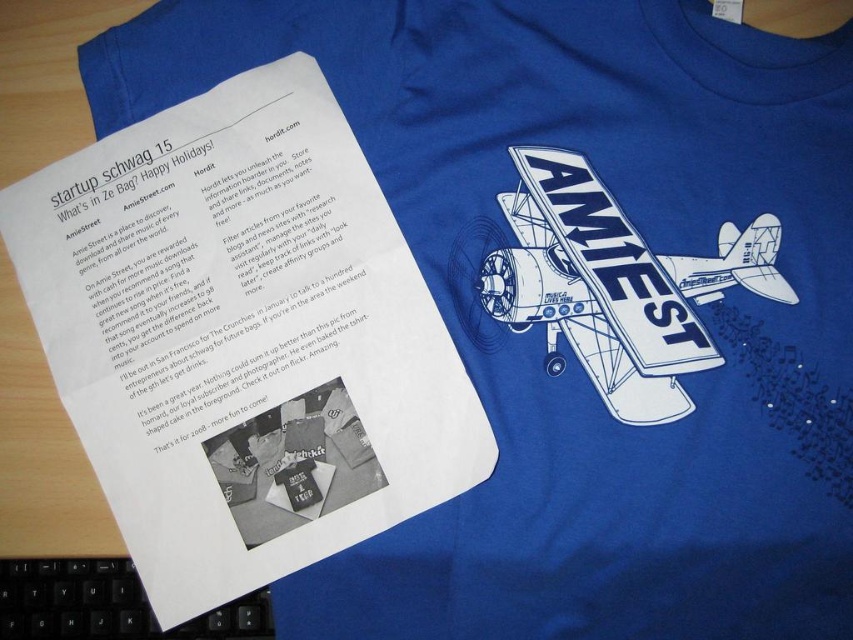
You are organizing a music event and need to place the white matte airplane at center and the black plastic keyboard at lower left on a stage. Based on their positions in the image, which object should be placed closer to the audience entrance?

The black plastic keyboard at lower left should be placed closer to the audience entrance because in the image, the white matte airplane at center is to the right of the black plastic keyboard at lower left, indicating the keyboard is positioned to the left side and thus closer to the entrance.

You are designing a layout for a catalog page. You have a white matte airplane at center and a black plastic keyboard at lower left. If you want to place them side by side horizontally, which object should be on the left to maintain balance?

The white matte airplane at center has a smaller width than the black plastic keyboard at lower left. To maintain balance when placing them side by side horizontally, the wider black plastic keyboard at lower left should be on the left side, and the narrower white matte airplane at center on the right.